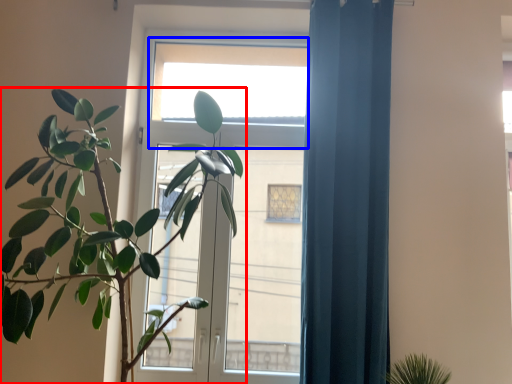
Question: Which object appears farthest to the camera in this image, houseplant (highlighted by a red box) or window (highlighted by a blue box)?

Choices:
 (A) houseplant
 (B) window

Answer: (B)